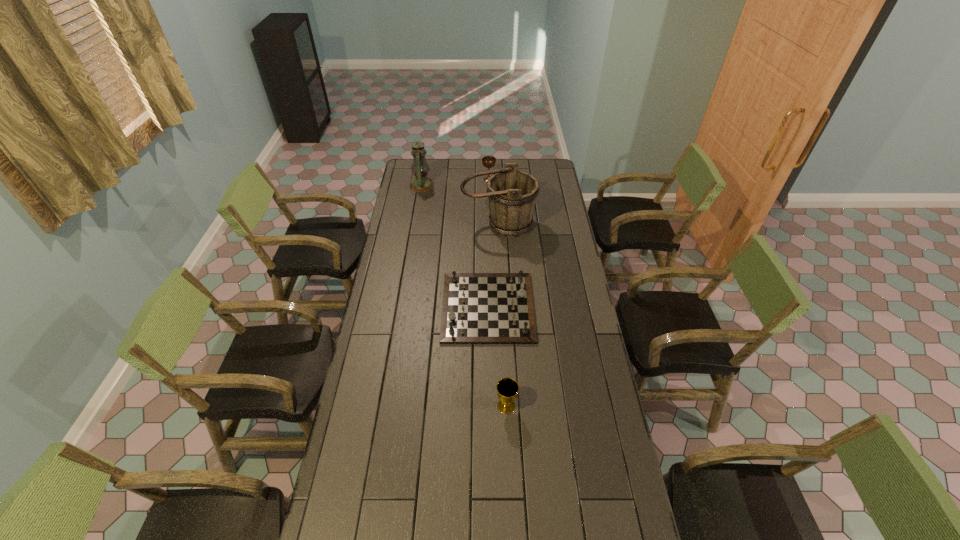
At what (x,y) coordinates should I click in order to perform the action: click on oil lamp. Please return your answer as a coordinate pair (x, y). The image size is (960, 540). Looking at the image, I should click on (421, 183).

This screenshot has width=960, height=540. I want to click on the third farthest object, so click(x=512, y=194).

Find the location of a particular element. the farther chalice is located at coordinates pos(488,161).

Where is `the nearest object`? The image size is (960, 540). the nearest object is located at coordinates (507, 388).

Where is `the shortest object`? The height and width of the screenshot is (540, 960). the shortest object is located at coordinates (x=478, y=308).

The width and height of the screenshot is (960, 540). Identify the location of chessboard. (478, 308).

Where is `free space located 0.200m on the back of the oil lamp`? This screenshot has width=960, height=540. free space located 0.200m on the back of the oil lamp is located at coordinates (426, 160).

Locate an element on the screen. free space located 0.200m on the handle side of the bucket is located at coordinates (500, 269).

Image resolution: width=960 pixels, height=540 pixels. In order to click on free spot located 0.300m on the right of the farther chalice in this screenshot , I will do `click(546, 179)`.

This screenshot has height=540, width=960. Find the location of `blank area located on the right of the nearest object`. blank area located on the right of the nearest object is located at coordinates (551, 406).